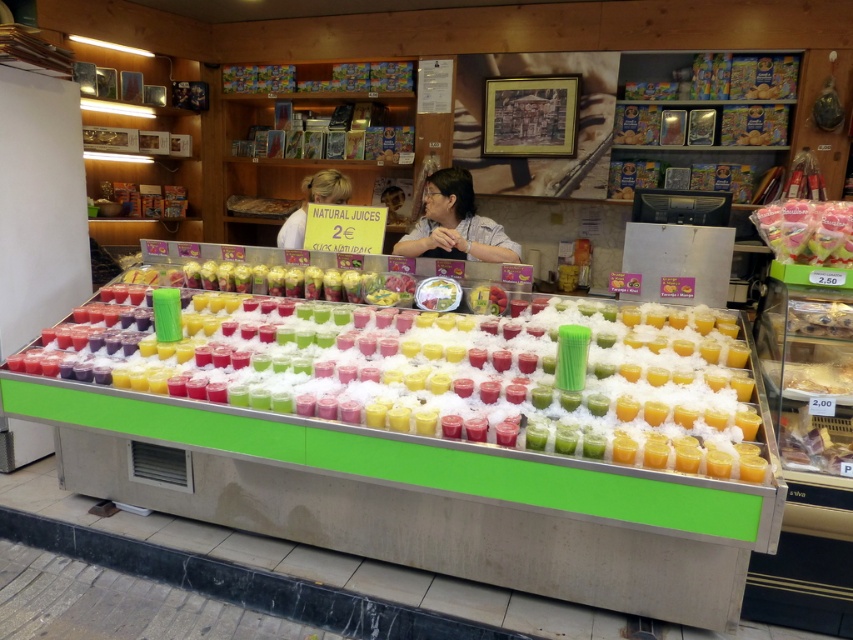
Question: Can you confirm if matte gray shirt at center is positioned above smooth white shirt at center?

Choices:
 (A) no
 (B) yes

Answer: (A)

Question: Which point is closer to the camera taking this photo?

Choices:
 (A) (297, 220)
 (B) (296, 307)

Answer: (B)

Question: Can you confirm if matte gray shirt at center is positioned below translucent plastic candy at upper right?

Choices:
 (A) no
 (B) yes

Answer: (A)

Question: Does translucent plastic bag at lower right have a greater width compared to smooth white shirt at center?

Choices:
 (A) yes
 (B) no

Answer: (B)

Question: Which of the following is the farthest from the observer?

Choices:
 (A) translucent plastic cups at center
 (B) matte gray shirt at center
 (C) translucent plastic candy at upper right
 (D) translucent plastic bag at lower right

Answer: (B)

Question: Which point is closer to the camera?

Choices:
 (A) matte gray shirt at center
 (B) translucent plastic cups at center
 (C) translucent plastic candy at upper right
 (D) translucent plastic bag at lower right

Answer: (B)